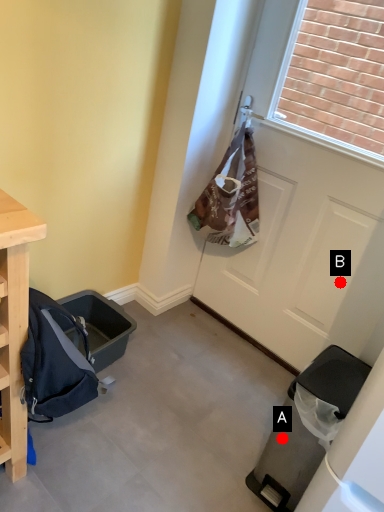
Question: Two points are circled on the image, labeled by A and B beside each circle. Which point is farther to the camera?

Choices:
 (A) A is further
 (B) B is further

Answer: (B)